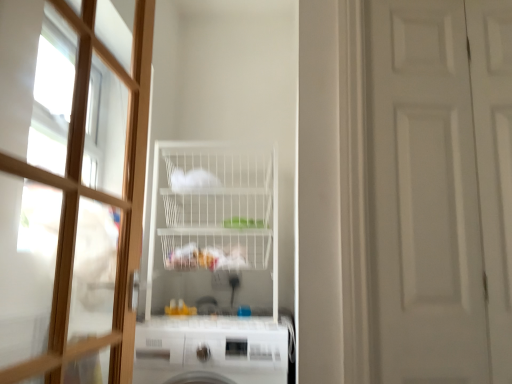
Question: Does white wire shelf at center have a smaller size compared to wooden door at left, the first door from the left?

Choices:
 (A) yes
 (B) no

Answer: (B)

Question: Is white wire shelf at center facing away from wooden door at left, which appears as the 2th door when viewed from the right?

Choices:
 (A) yes
 (B) no

Answer: (B)

Question: Does white wire shelf at center have a larger size compared to wooden door at left, the first door from the left?

Choices:
 (A) yes
 (B) no

Answer: (A)

Question: Is white wire shelf at center surrounding wooden door at left, the first door from the left?

Choices:
 (A) no
 (B) yes

Answer: (A)

Question: Does white wire shelf at center have a greater width compared to wooden door at left, the first door from the left?

Choices:
 (A) no
 (B) yes

Answer: (B)

Question: Looking at their shapes, would you say white matte door at right, which is counted as the 1th door, starting from the right, is wider or thinner than wooden door at left, the first door from the left?

Choices:
 (A) thin
 (B) wide

Answer: (A)

Question: Based on their positions, is white matte door at right, which is counted as the 1th door, starting from the right, located to the left or right of wooden door at left, the first door from the left?

Choices:
 (A) right
 (B) left

Answer: (A)

Question: Is white matte door at right, placed as the second door when sorted from left to right, in front of or behind wooden door at left, the first door from the left, in the image?

Choices:
 (A) front
 (B) behind

Answer: (B)

Question: Is white matte door at right, which is counted as the 1th door, starting from the right, inside or outside of wooden door at left, the first door from the left?

Choices:
 (A) outside
 (B) inside

Answer: (A)

Question: From the image's perspective, relative to white matte door at right, placed as the second door when sorted from left to right, is wooden door at left, the first door from the left, above or below?

Choices:
 (A) above
 (B) below

Answer: (A)

Question: From a real-world perspective, is wooden door at left, the first door from the left, positioned above or below white matte door at right, which is counted as the 1th door, starting from the right?

Choices:
 (A) below
 (B) above

Answer: (A)

Question: Considering the positions of point (66, 177) and point (396, 31), is point (66, 177) closer or farther from the camera than point (396, 31)?

Choices:
 (A) closer
 (B) farther

Answer: (A)

Question: Which is correct: wooden door at left, the first door from the left, is inside white matte door at right, placed as the second door when sorted from left to right, or outside of it?

Choices:
 (A) inside
 (B) outside

Answer: (B)

Question: From a real-world perspective, is white wire shelf at center above or below white matte door at right, placed as the second door when sorted from left to right?

Choices:
 (A) above
 (B) below

Answer: (B)

Question: Is point (245, 165) closer or farther from the camera than point (406, 28)?

Choices:
 (A) farther
 (B) closer

Answer: (A)